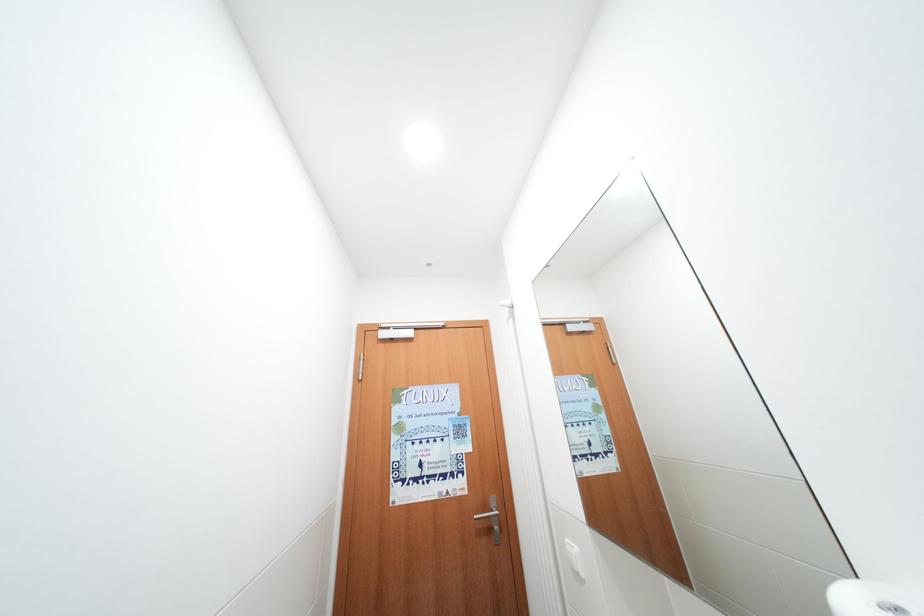
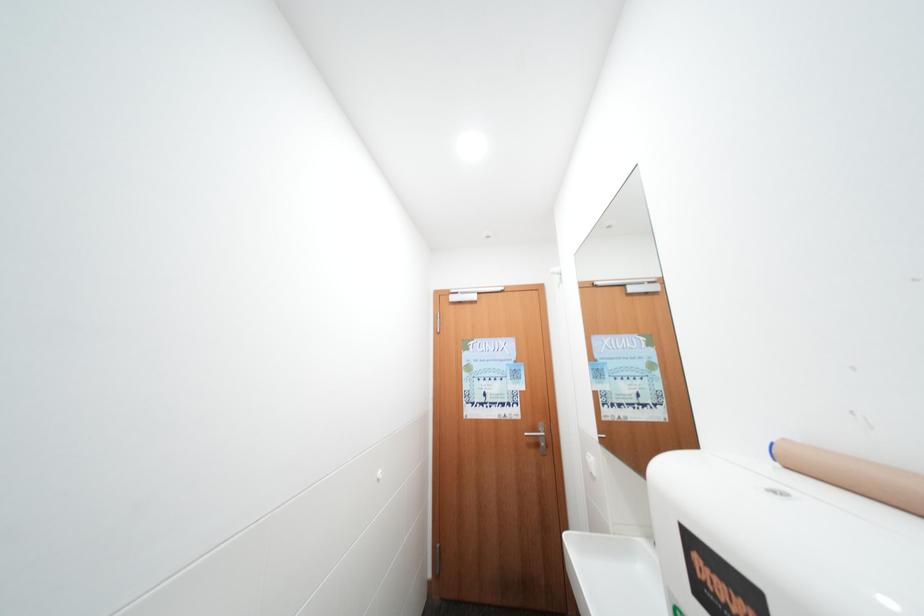
In a continuous first-person perspective shot, in which direction is the camera moving?

The movement direction of the cameraman is right, backward.